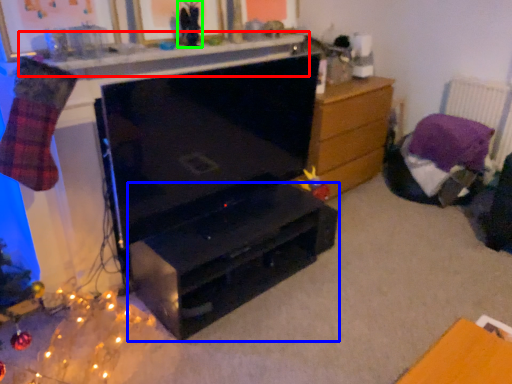
Question: Estimate the real-world distances between objects in this image. Which object is closer to counter top (highlighted by a red box), desk (highlighted by a blue box) or toy (highlighted by a green box)?

Choices:
 (A) desk
 (B) toy

Answer: (B)